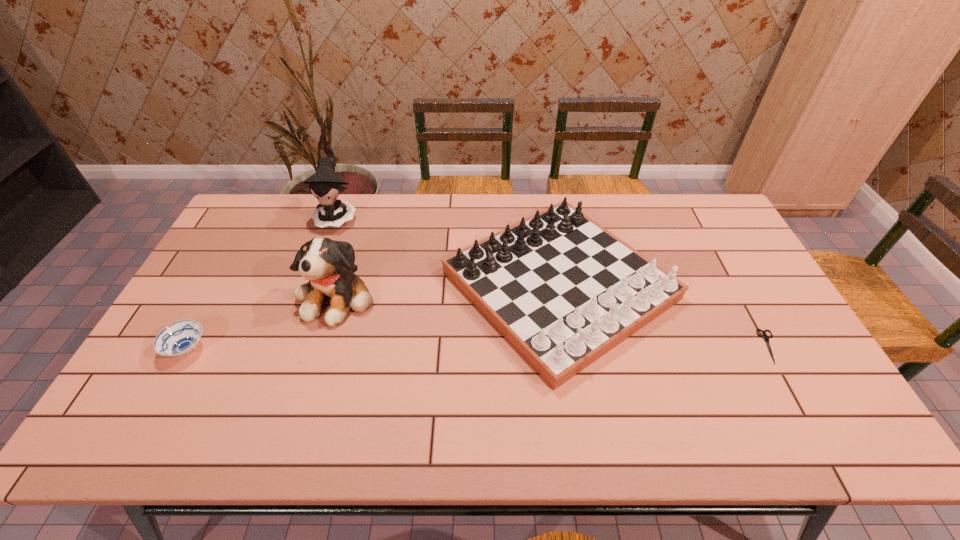
Find the location of a particular element. free space located 0.230m on the left of the gameboard is located at coordinates (365, 286).

Identify the location of free space located on the right of the leftmost object. Image resolution: width=960 pixels, height=540 pixels. (273, 349).

Identify the location of free spot located 0.090m on the back of the rightmost object. The image size is (960, 540). (748, 305).

Identify the location of doll that is positioned at the far edge. This screenshot has height=540, width=960. (325, 185).

Image resolution: width=960 pixels, height=540 pixels. Find the location of `gameboard located at the far edge`. gameboard located at the far edge is located at coordinates (563, 291).

Locate an element on the screen. Image resolution: width=960 pixels, height=540 pixels. object located in the left edge section of the desktop is located at coordinates (180, 338).

Find the location of a particular element. Image resolution: width=960 pixels, height=540 pixels. object that is positioned at the right edge is located at coordinates (766, 338).

I want to click on vacant area at the far edge of the desktop, so click(373, 221).

In order to click on vacant space at the near edge in this screenshot , I will do `click(656, 445)`.

Image resolution: width=960 pixels, height=540 pixels. In the image, there is a desktop. Find the location of `free space at the left edge`. free space at the left edge is located at coordinates (178, 384).